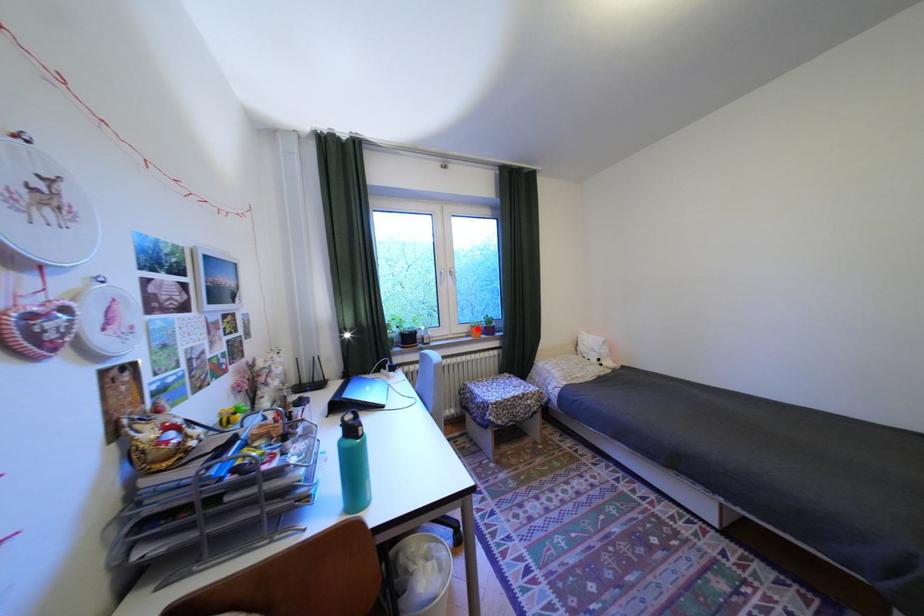
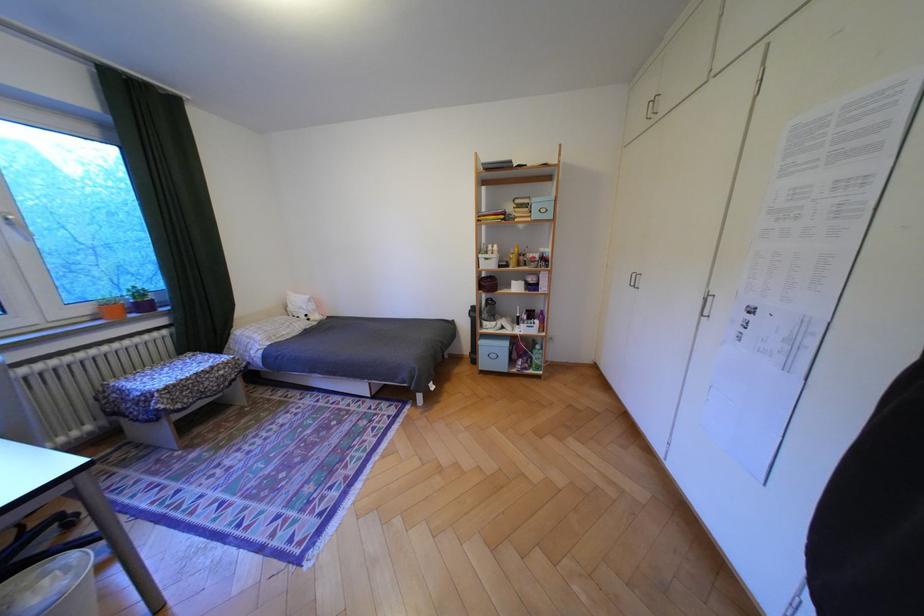
In the second image, find the point that corresponds to the highlighted location in the first image.

(99, 310)